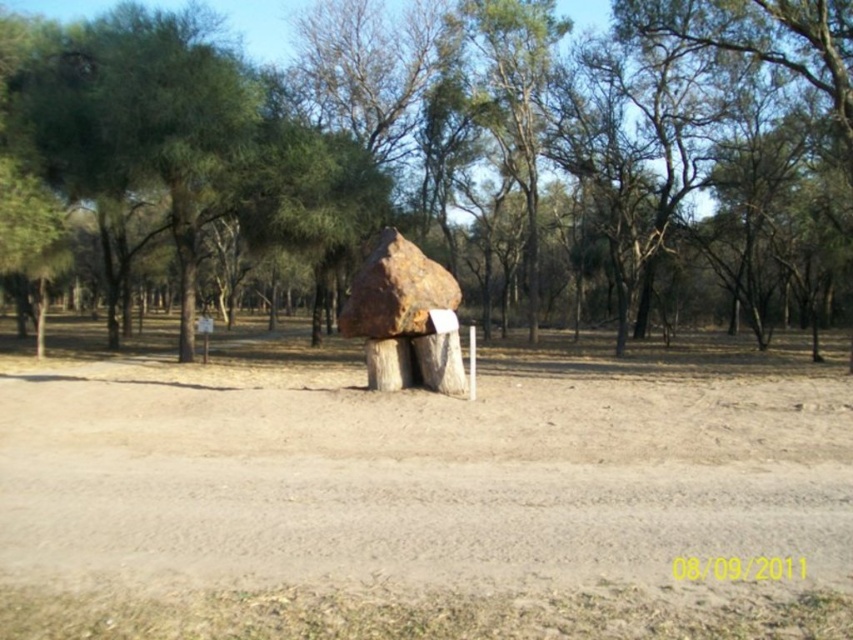
Consider the image. You are a gardener planning to plant flowers in the brown dirt field at center and the rustic wood sculpture at center. Which location has more space available for planting?

The rustic wood sculpture at center has more space available for planting because the brown dirt field at center has a lesser width compared to rustic wood sculpture at center.

You are standing at the starting point of the dirt path in the foreground and want to reach the rustic shelter with the reddish brown rock roof. According to the coordinates provided in the Objects Description, is the brown dirt field at center directly in front of you or to the side?

The brown dirt field at center is located at point (421, 493), which places it directly in front of your path towards the rustic shelter with the reddish brown rock roof.

You are standing on the dirt path in the park and see the brown dirt field at center and the green leafy tree at upper center. Which object is closer to the ground?

The brown dirt field at center is closer to the ground because it is below the green leafy tree at upper center.